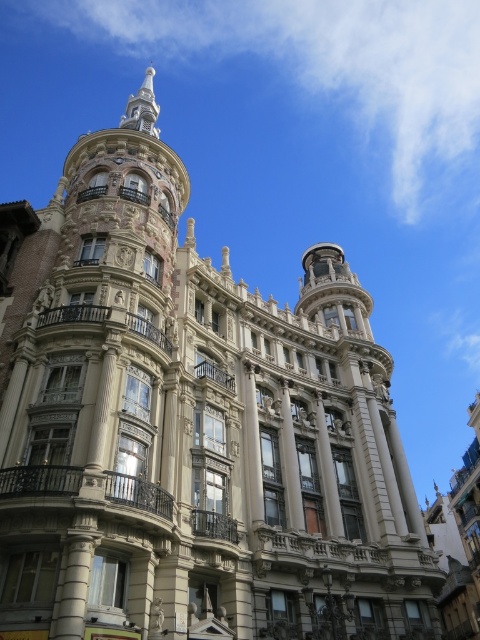
You are an architect inspecting the building facade. You notice two central structures, the white marble column at center and the smooth stone pillar at center. Which one appears higher in the image?

The white marble column at center is positioned over the smooth stone pillar at center, so it appears higher in the image.

You are an architect evaluating the building facade. You notice the white marble column at center and the brown polished stone pillar at center. Which one appears bigger in size?

The white marble column at center has a larger size compared to the brown polished stone pillar at center, so it appears bigger.

You are standing at the entrance of the grand building and want to locate the brown polished stone pillar at center. According to the coordinates provided, where should you look to find it?

The brown polished stone pillar at center is located at coordinates point (290, 461), so you should look towards the lower right area of the building facade to find it.